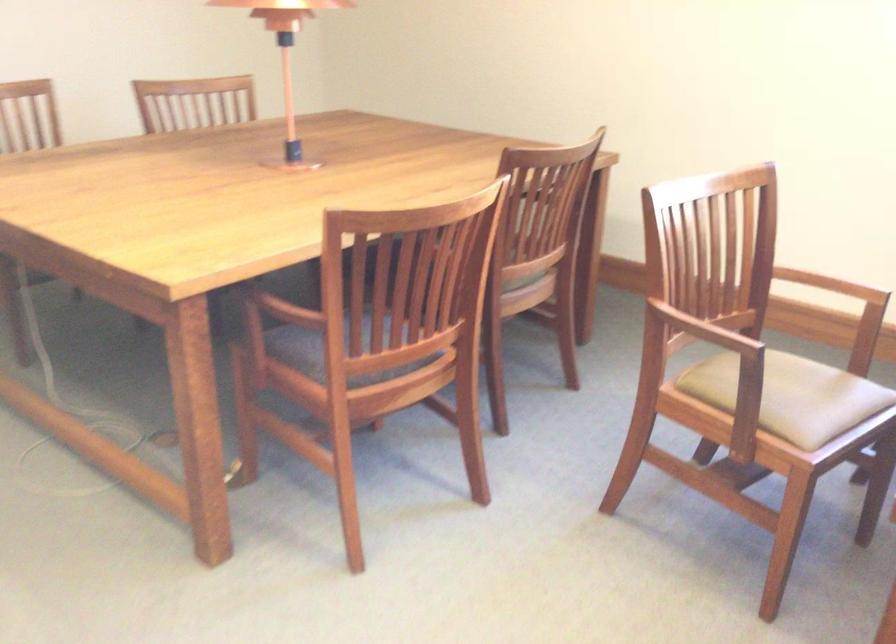
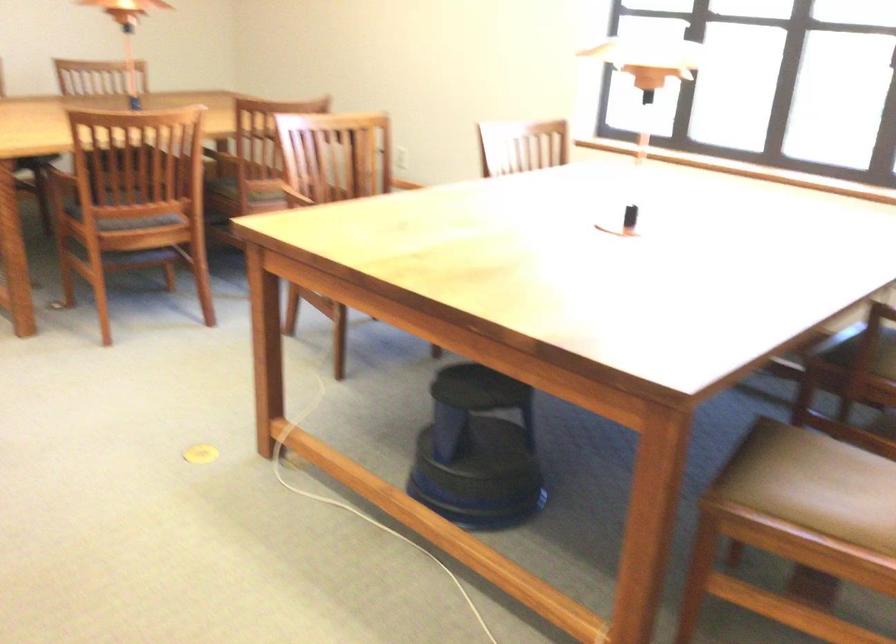
The point at (389, 365) is marked in the first image. Where is the corresponding point in the second image?

(128, 209)